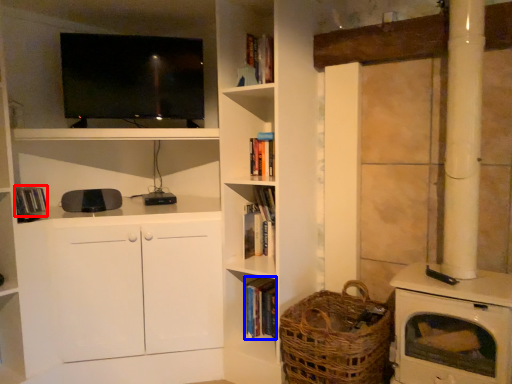
Question: Which point is closer to the camera, book (highlighted by a red box) or book (highlighted by a blue box)?

Choices:
 (A) book
 (B) book

Answer: (A)